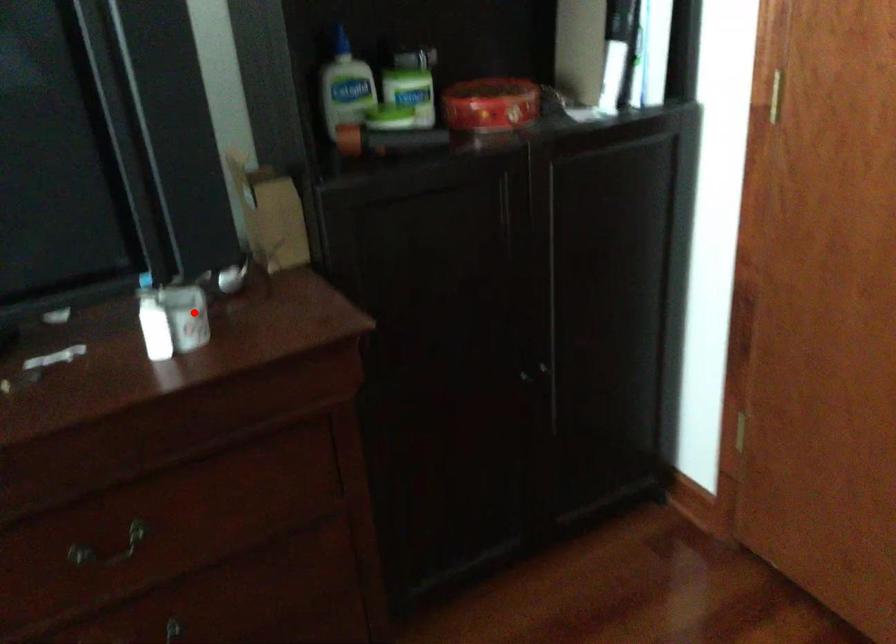
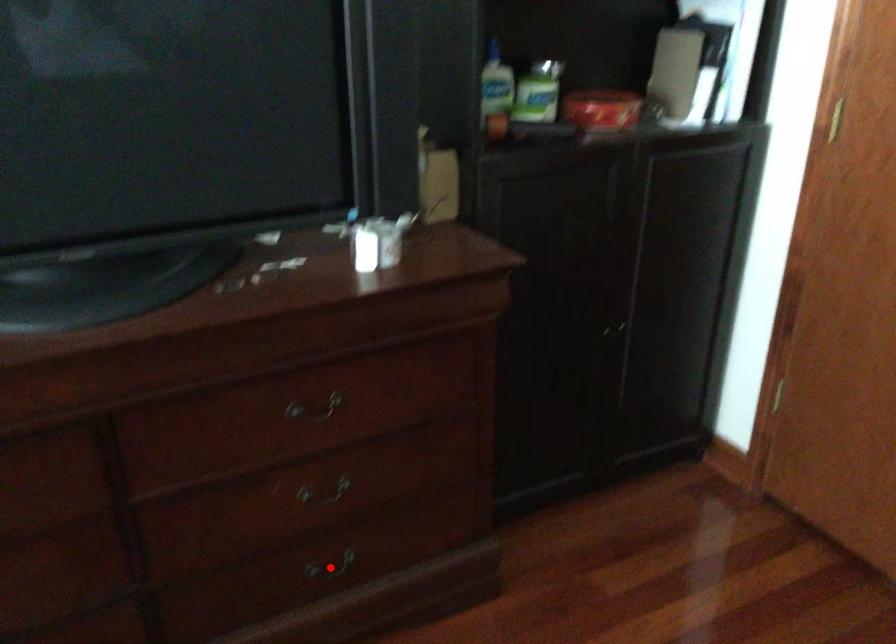
I am providing you with two images of the same scene from different viewpoints. A red point is marked on the first image and another point is marked on the second image. Are the points marked in image1 and image2 representing the same 3D position?

No